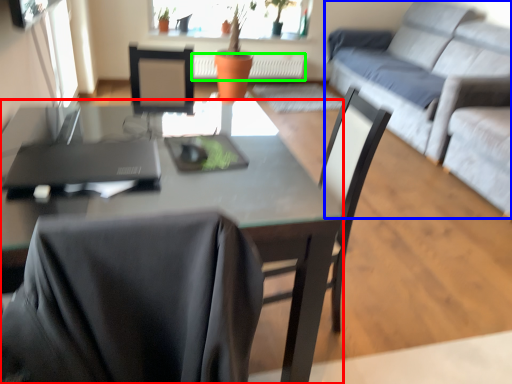
Question: Estimate the real-world distances between objects in this image. Which object is closer to desk (highlighted by a red box), studio couch (highlighted by a blue box) or radiator (highlighted by a green box)?

Choices:
 (A) studio couch
 (B) radiator

Answer: (A)